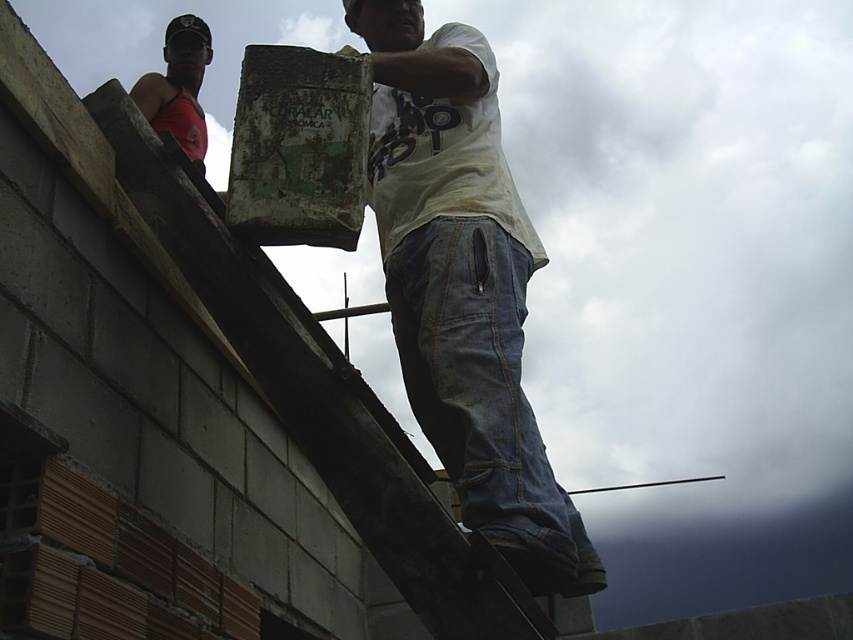
In the scene shown: Who is more distant from viewer, (497, 420) or (177, 68)?

The point (177, 68) is behind.

This screenshot has height=640, width=853. Describe the element at coordinates (463, 285) in the screenshot. I see `white cotton shirt at center` at that location.

Find the location of a particular element. white cotton shirt at center is located at coordinates 463,285.